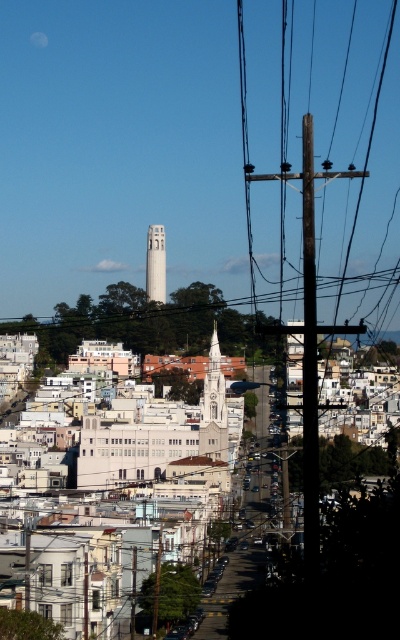
Question: Is wooden pole at right wider than dark brown wooden telegraph pole at center?

Choices:
 (A) no
 (B) yes

Answer: (B)

Question: Does wooden pole at right appear on the right side of white stone clock tower at center?

Choices:
 (A) yes
 (B) no

Answer: (A)

Question: Where is wooden pole at right located in relation to white concrete tower at center in the image?

Choices:
 (A) above
 (B) below

Answer: (A)

Question: Which of these objects is positioned farthest from the wooden pole at right?

Choices:
 (A) white stone clock tower at center
 (B) dark brown wooden telegraph pole at center

Answer: (A)

Question: Based on their relative distances, which object is nearer to the wooden pole at right?

Choices:
 (A) white concrete tower at center
 (B) dark brown wooden telegraph pole at center
 (C) white stone clock tower at center

Answer: (B)

Question: Which is nearer to the white stone clock tower at center?

Choices:
 (A) white concrete tower at center
 (B) wooden pole at right
 (C) dark brown wooden telegraph pole at center

Answer: (C)